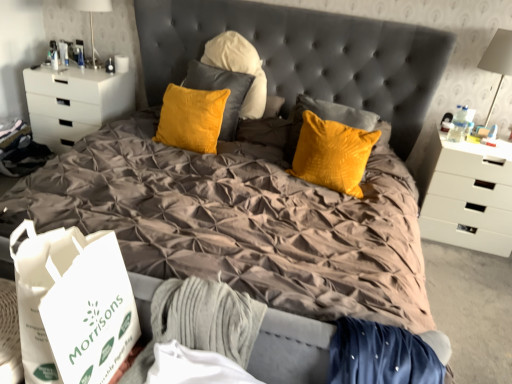
Find the location of a particular element. vacant space underneath white plastic table lamp at upper right, the 2th table lamp viewed from the back (from a real-world perspective) is located at coordinates (482, 137).